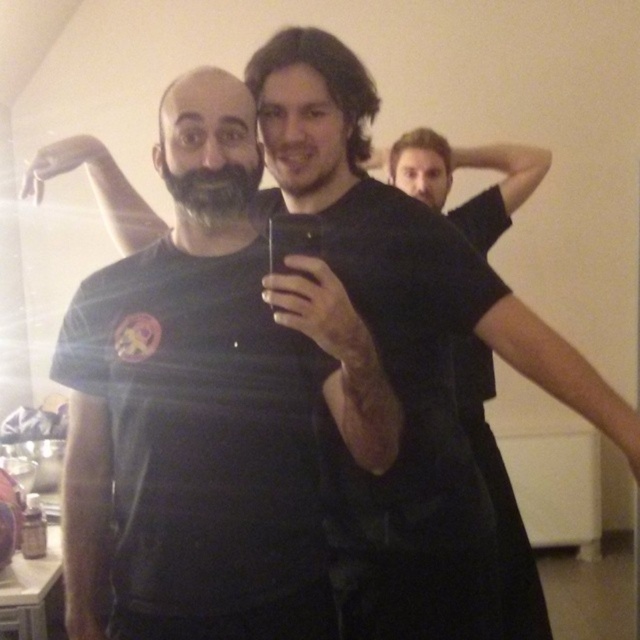
Question: Among these objects, which one is nearest to the camera?

Choices:
 (A) gray matte beard at center
 (B) black matte t-shirt at right

Answer: (A)

Question: Which of the following is the closest to the observer?

Choices:
 (A) (244, 612)
 (B) (509, 630)

Answer: (A)

Question: Based on their relative distances, which object is farther from the black matte t-shirt at right?

Choices:
 (A) black matte t-shirt at center
 (B) gray matte beard at center

Answer: (A)

Question: Can you confirm if black matte t-shirt at center is positioned above gray matte beard at center?

Choices:
 (A) no
 (B) yes

Answer: (A)

Question: Does black matte t-shirt at center have a lesser width compared to gray matte beard at center?

Choices:
 (A) no
 (B) yes

Answer: (A)

Question: Does black matte t-shirt at center appear on the left side of gray matte beard at center?

Choices:
 (A) yes
 (B) no

Answer: (A)